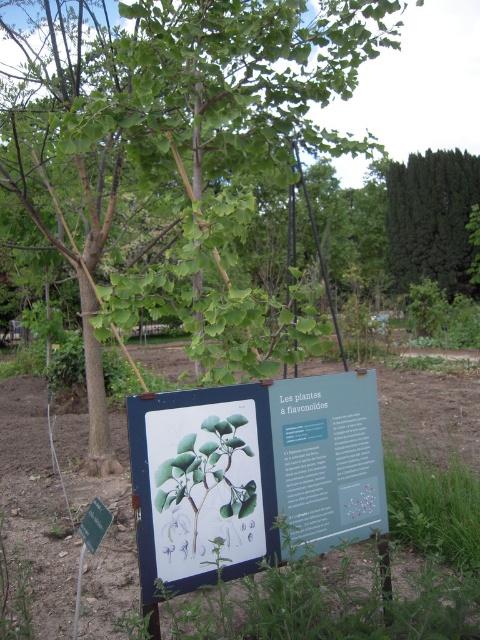
Question: Does green leafy tree at center have a smaller size compared to brown soil at center?

Choices:
 (A) yes
 (B) no

Answer: (B)

Question: Where is green paper sign at center located in relation to brown soil at center in the image?

Choices:
 (A) left
 (B) right

Answer: (B)

Question: Can you confirm if green paper sign at center is positioned to the left of brown soil at center?

Choices:
 (A) no
 (B) yes

Answer: (A)

Question: Among these points, which one is nearest to the camera?

Choices:
 (A) (60, 580)
 (B) (237, 563)

Answer: (B)

Question: Which of these objects is positioned farthest from the green leafy tree at center?

Choices:
 (A) green paper sign at center
 (B) dark green coniferous tree at upper right
 (C) brown soil at center

Answer: (B)

Question: Which object is positioned farthest from the green leafy tree at center?

Choices:
 (A) brown soil at center
 (B) dark green coniferous tree at upper right

Answer: (B)